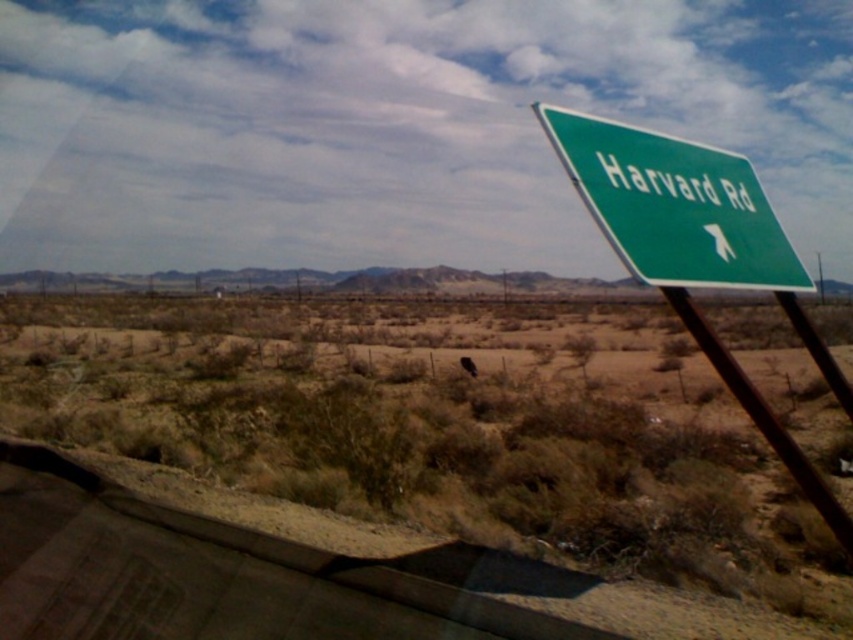
You are a delivery driver who needs to navigate through Harvard Rd. You see a point marked at coordinates (698, 252). What object is located at this point?

The point at coordinates (698, 252) marks the green plastic street sign at upper right.

You are a delivery driver who needs to read the text on both the green plastic street sign at upper right and the green glossy sign at upper right. Which sign will you need to look up higher to read?

The green plastic street sign at upper right is much taller than the green glossy sign at upper right, so you need to look up higher to read the green plastic street sign at upper right.